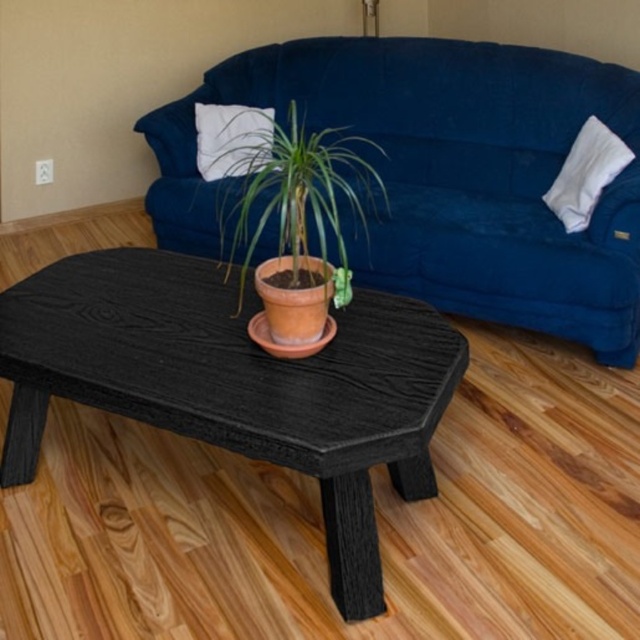
Does black wood table at center have a larger size compared to terracotta clay pot at center?

No, black wood table at center is not bigger than terracotta clay pot at center.

How much distance is there between black wood table at center and terracotta clay pot at center?

black wood table at center and terracotta clay pot at center are 48.53 centimeters apart.

The image size is (640, 640). What do you see at coordinates (236, 384) in the screenshot? I see `black wood table at center` at bounding box center [236, 384].

Locate an element on the screen. black wood table at center is located at coordinates point(236,384).

Does white cotton pillow at upper right appear over white cotton pillow at upper left?

No.

What are the coordinates of `white cotton pillow at upper right` in the screenshot? It's located at (586, 173).

Who is higher up, velvet blue couch at center or white cotton pillow at upper right?

velvet blue couch at center is above.

Looking at this image, who is more distant from viewer, (298, 93) or (589, 150)?

The point (298, 93) is more distant.

Consider the image. Who is more distant from viewer, (388, 176) or (579, 204)?

The point (388, 176) is more distant.

Where is `velvet blue couch at center`? velvet blue couch at center is located at coordinates (440, 173).